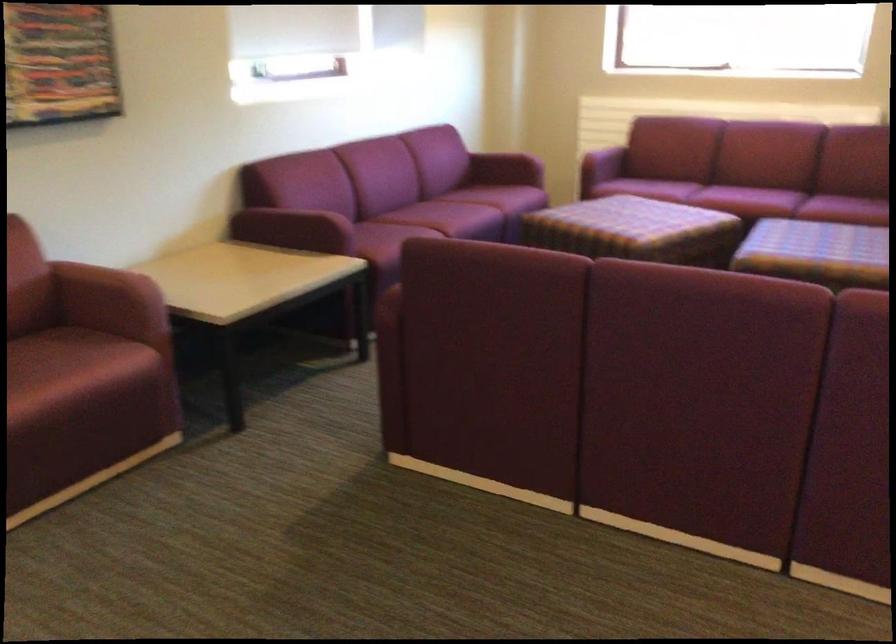
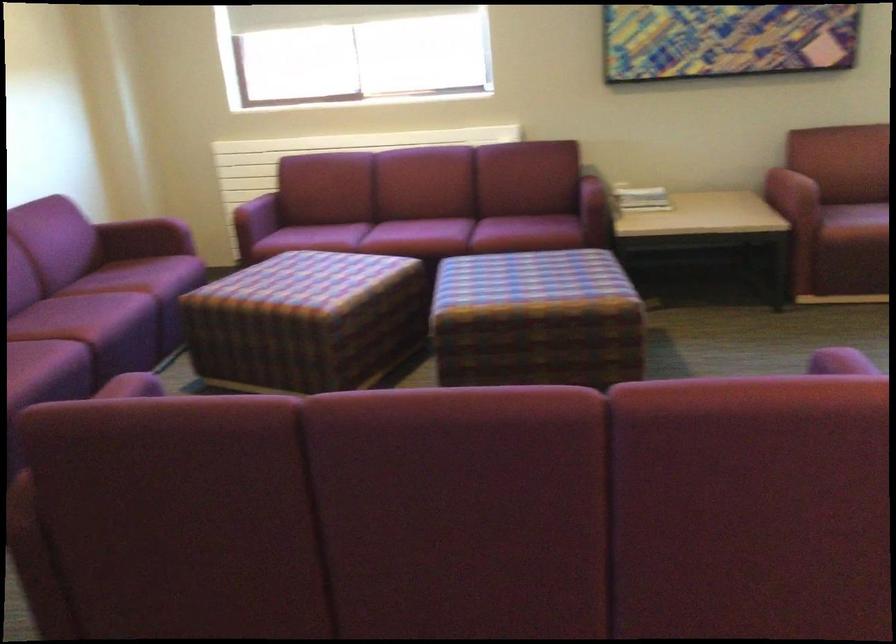
In the second image, find the point that corresponds to [470,216] in the first image.

(116, 313)